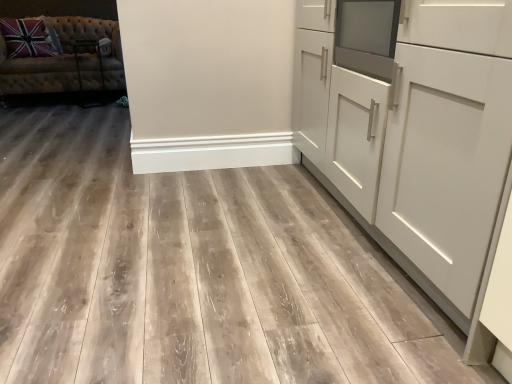
What is the approximate width of white matte cabinet at right?

It is 27.13 inches.

This screenshot has width=512, height=384. Identify the location of white matte cabinet at right. click(x=444, y=146).

What do you see at coordinates (444, 146) in the screenshot? This screenshot has height=384, width=512. I see `white matte cabinet at right` at bounding box center [444, 146].

I want to click on tufted fabric studio couch at upper left, so click(x=65, y=60).

What do you see at coordinates (65, 60) in the screenshot? I see `tufted fabric studio couch at upper left` at bounding box center [65, 60].

Where is `white matte cabinet at right`? This screenshot has height=384, width=512. white matte cabinet at right is located at coordinates (444, 146).

Does white matte cabinet at right appear on the left side of tufted fabric studio couch at upper left?

No.

Which object is more forward, white matte cabinet at right or tufted fabric studio couch at upper left?

Positioned in front is white matte cabinet at right.

Considering the points (481, 254) and (10, 85), which point is behind, point (481, 254) or point (10, 85)?

The point (10, 85) is behind.

From the image's perspective, is white matte cabinet at right under tufted fabric studio couch at upper left?

Yes.

From a real-world perspective, is white matte cabinet at right above or below tufted fabric studio couch at upper left?

white matte cabinet at right is situated higher than tufted fabric studio couch at upper left in the real world.

Considering the sizes of objects white matte cabinet at right and tufted fabric studio couch at upper left in the image provided, who is wider, white matte cabinet at right or tufted fabric studio couch at upper left?

Wider between the two is tufted fabric studio couch at upper left.

Considering the sizes of white matte cabinet at right and tufted fabric studio couch at upper left in the image, is white matte cabinet at right taller or shorter than tufted fabric studio couch at upper left?

Considering their sizes, white matte cabinet at right has more height than tufted fabric studio couch at upper left.

Considering the sizes of white matte cabinet at right and tufted fabric studio couch at upper left in the image, is white matte cabinet at right bigger or smaller than tufted fabric studio couch at upper left?

Clearly, white matte cabinet at right is larger in size than tufted fabric studio couch at upper left.

Is tufted fabric studio couch at upper left a part of white matte cabinet at right?

No.

Is white matte cabinet at right with tufted fabric studio couch at upper left?

white matte cabinet at right and tufted fabric studio couch at upper left are clearly separated.

Is white matte cabinet at right turned away from tufted fabric studio couch at upper left?

That's not correct — white matte cabinet at right is not looking away from tufted fabric studio couch at upper left.

How many degrees apart are the facing directions of white matte cabinet at right and tufted fabric studio couch at upper left?

white matte cabinet at right and tufted fabric studio couch at upper left are facing 94.9 degrees away from each other.

Find the location of a particular element. The width and height of the screenshot is (512, 384). cabinetry below the tufted fabric studio couch at upper left (from the image's perspective) is located at coordinates (444, 146).

Visually, is tufted fabric studio couch at upper left positioned to the left or to the right of white matte cabinet at right?

From the image, it's evident that tufted fabric studio couch at upper left is to the left of white matte cabinet at right.

Is the position of tufted fabric studio couch at upper left more distant than that of white matte cabinet at right?

That is True.

Does point (106, 76) lie in front of point (418, 176)?

No, (106, 76) is further to viewer.

From the image's perspective, which is above, tufted fabric studio couch at upper left or white matte cabinet at right?

tufted fabric studio couch at upper left.

From a real-world perspective, relative to white matte cabinet at right, is tufted fabric studio couch at upper left vertically above or below?

Clearly, from a real-world perspective, tufted fabric studio couch at upper left is below white matte cabinet at right.

Between tufted fabric studio couch at upper left and white matte cabinet at right, which one has smaller width?

Thinner between the two is white matte cabinet at right.

Considering the sizes of tufted fabric studio couch at upper left and white matte cabinet at right in the image, is tufted fabric studio couch at upper left taller or shorter than white matte cabinet at right?

Clearly, tufted fabric studio couch at upper left is shorter compared to white matte cabinet at right.

Looking at this image, is tufted fabric studio couch at upper left bigger or smaller than white matte cabinet at right?

In the image, tufted fabric studio couch at upper left appears to be smaller than white matte cabinet at right.

Consider the image. Is white matte cabinet at right completely or partially inside tufted fabric studio couch at upper left?

No, white matte cabinet at right is not inside tufted fabric studio couch at upper left.

Does tufted fabric studio couch at upper left touch white matte cabinet at right?

No, tufted fabric studio couch at upper left is not in contact with white matte cabinet at right.

Does tufted fabric studio couch at upper left turn towards white matte cabinet at right?

Yes, tufted fabric studio couch at upper left is oriented towards white matte cabinet at right.

This screenshot has height=384, width=512. I want to click on cabinetry in front of the tufted fabric studio couch at upper left, so click(x=444, y=146).

Find the location of a particular element. studio couch that is behind the white matte cabinet at right is located at coordinates click(x=65, y=60).

Identify the location of cabinetry on the right of tufted fabric studio couch at upper left. (444, 146).